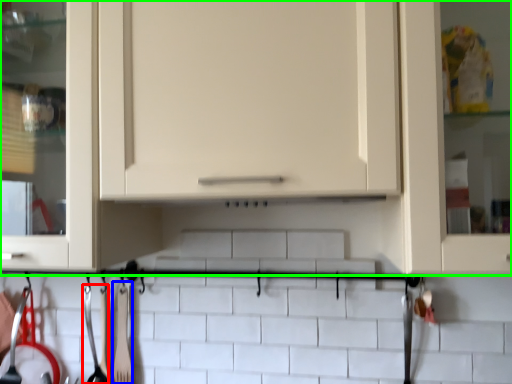
Question: Considering the real-world distances, which object is farthest from silverware (highlighted by a red box)? silverware (highlighted by a blue box) or cabinetry (highlighted by a green box)?

Choices:
 (A) silverware
 (B) cabinetry

Answer: (B)